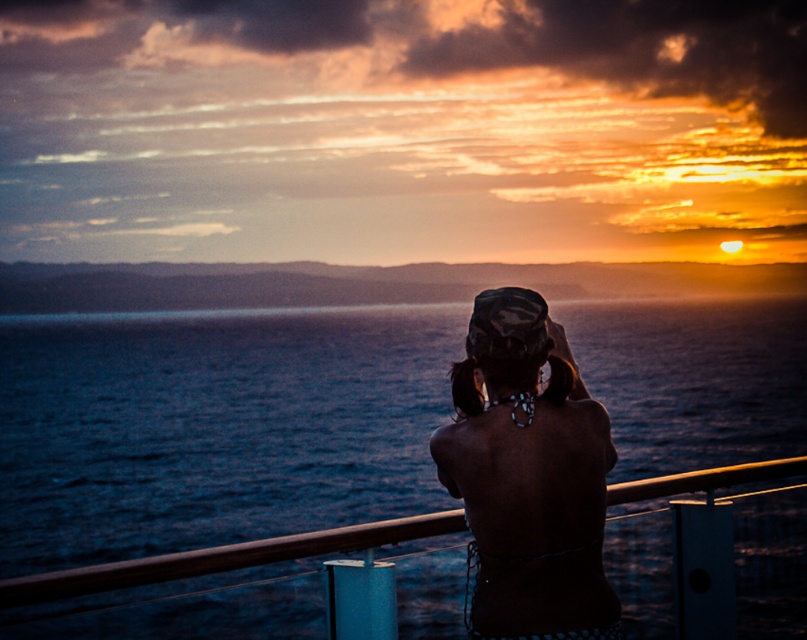
Based on the photo, who is positioned more to the left, matte black bikini top at center or black matte hat at center?

black matte hat at center

Which is below, matte black bikini top at center or black matte hat at center?

Positioned lower is matte black bikini top at center.

What are the coordinates of `matte black bikini top at center` in the screenshot? It's located at (529, 476).

Can you confirm if dark blue water at center is positioned below matte black bikini top at center?

Indeed, dark blue water at center is positioned under matte black bikini top at center.

Which is behind, point (72, 467) or point (567, 493)?

Point (72, 467)

You are a GUI agent. You are given a task and a screenshot of the screen. Output one action in this format:
    pyautogui.click(x=<x>, y=<y>)
    Task: Click on the dark blue water at center
    
    Given the screenshot: What is the action you would take?
    pyautogui.click(x=214, y=428)

The width and height of the screenshot is (807, 640). What do you see at coordinates (214, 428) in the screenshot? I see `dark blue water at center` at bounding box center [214, 428].

Who is more distant from viewer, (57, 339) or (471, 385)?

Point (57, 339)

You are a GUI agent. You are given a task and a screenshot of the screen. Output one action in this format:
    pyautogui.click(x=<x>, y=<y>)
    Task: Click on the dark blue water at center
    
    Given the screenshot: What is the action you would take?
    pyautogui.click(x=214, y=428)